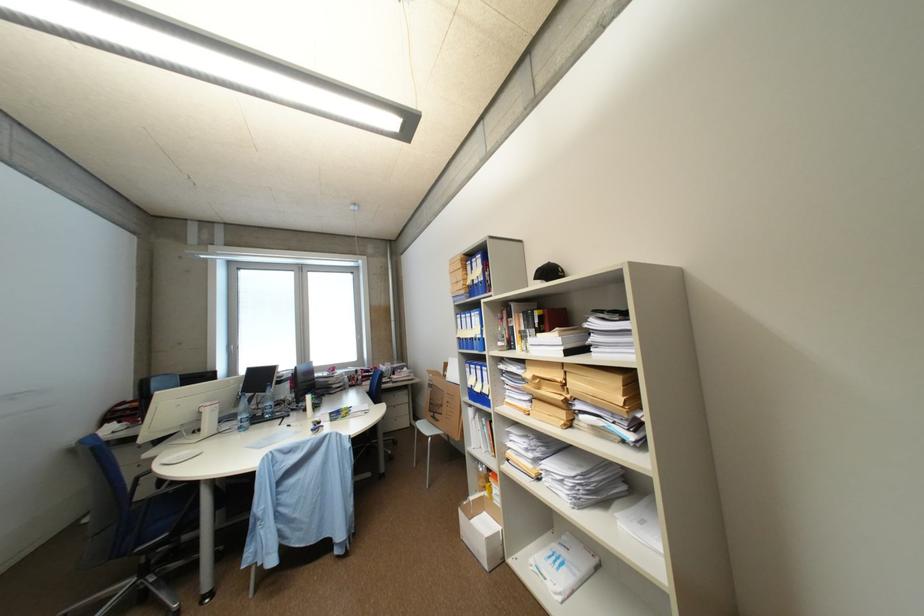
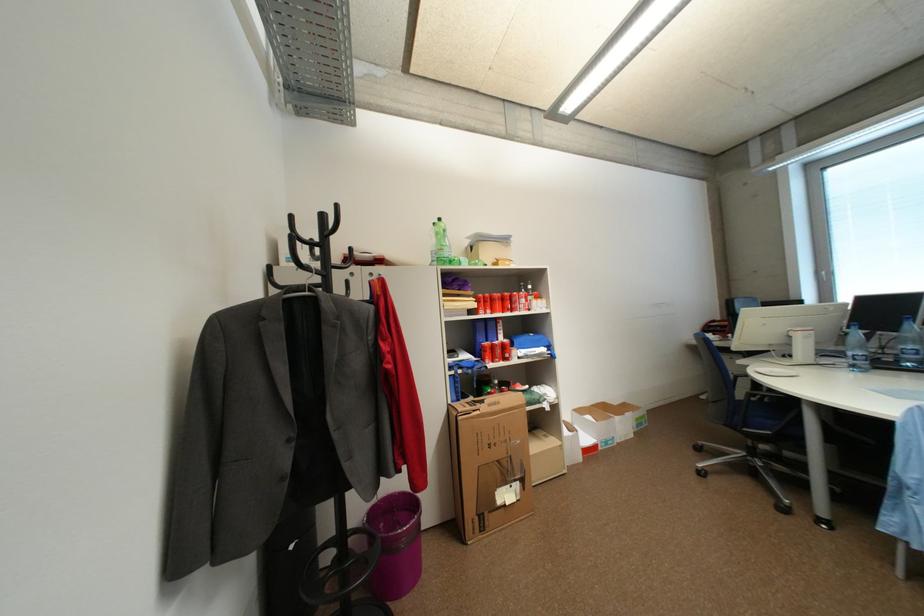
Where in the second image is the point corresponding to pixel 270 407 from the first image?

(897, 352)